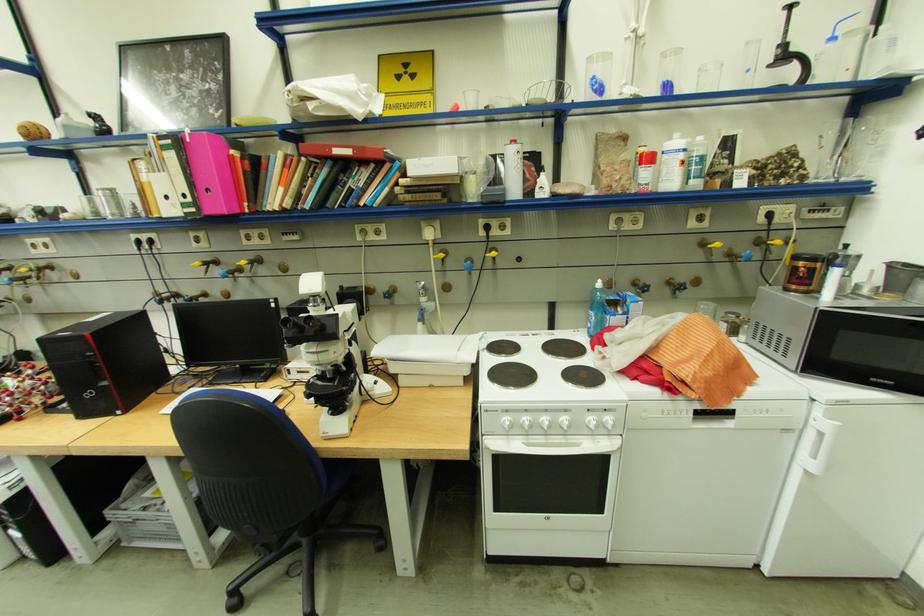
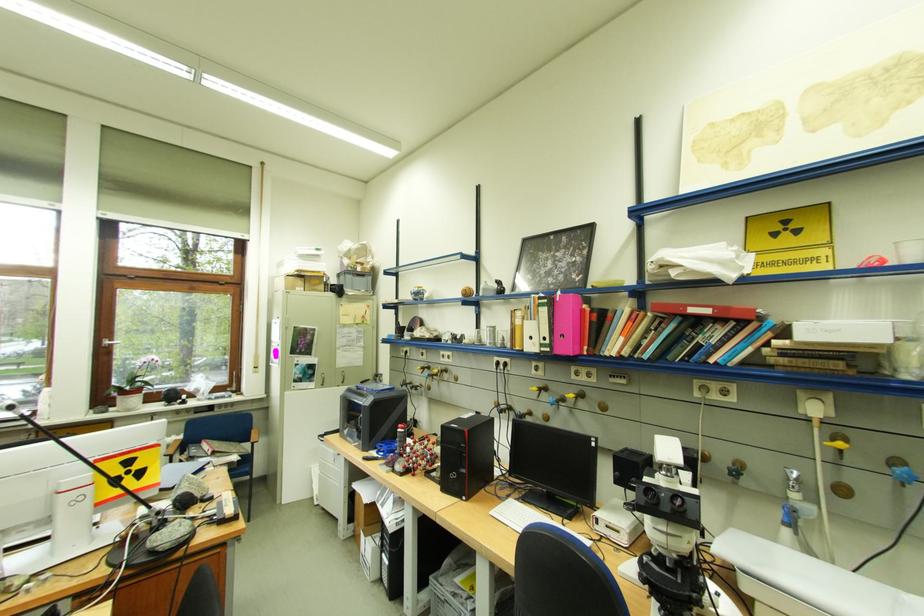
Locate, in the second image, the point that corresponds to point (116, 198) in the first image.

(500, 331)